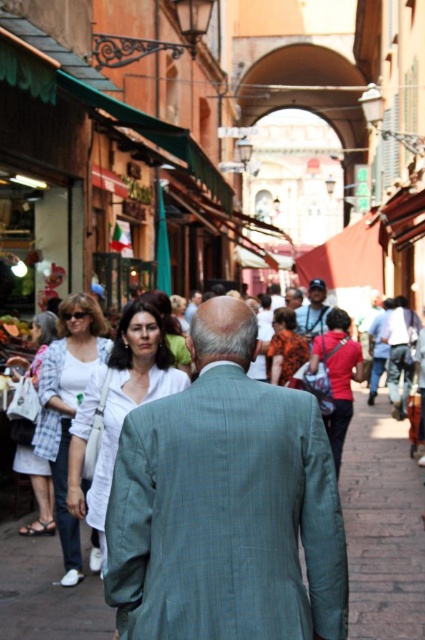
In the scene shown: Is green plaid suit at center positioned in front of smooth white blouse at center?

Yes, green plaid suit at center is closer to the viewer.

Is green plaid suit at center shorter than smooth white blouse at center?

In fact, green plaid suit at center may be taller than smooth white blouse at center.

Where is `green plaid suit at center`? green plaid suit at center is located at coordinates (226, 504).

Locate an element on the screen. green plaid suit at center is located at coordinates (226, 504).

Can you confirm if white matte shirt at center is positioned above orange floral dress at center?

No.

Can you confirm if white matte shirt at center is bigger than orange floral dress at center?

Actually, white matte shirt at center might be smaller than orange floral dress at center.

Between point (90, 520) and point (277, 326), which one is positioned in front?

Point (90, 520)

Find the location of a particular element. white matte shirt at center is located at coordinates (119, 404).

Is white cotton shirt at left positioned behind matte red shirt at center?

Yes, it is behind matte red shirt at center.

Can you confirm if white cotton shirt at left is positioned to the left of matte red shirt at center?

Indeed, white cotton shirt at left is positioned on the left side of matte red shirt at center.

Find the location of a particular element. The width and height of the screenshot is (425, 640). white cotton shirt at left is located at coordinates (68, 406).